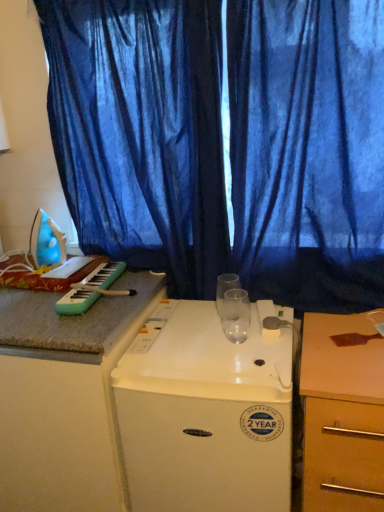
Question: Which direction should I rotate to look at blue sheer curtain at upper center, which ranks as the first curtain in left-to-right order, — up or down?

Choices:
 (A) down
 (B) up

Answer: (B)

Question: Should I look upward or downward to see wooden at right?

Choices:
 (A) down
 (B) up

Answer: (A)

Question: Is white plastic refrigerator at center surrounding blue plastic iron at left?

Choices:
 (A) yes
 (B) no

Answer: (B)

Question: Does white plastic refrigerator at center lie behind blue plastic iron at left?

Choices:
 (A) yes
 (B) no

Answer: (B)

Question: From the image's perspective, is white plastic refrigerator at center above blue plastic iron at left?

Choices:
 (A) no
 (B) yes

Answer: (A)

Question: From the image's perspective, is white plastic refrigerator at center below blue plastic iron at left?

Choices:
 (A) no
 (B) yes

Answer: (B)

Question: Would you say white plastic refrigerator at center is a long distance from blue plastic iron at left?

Choices:
 (A) yes
 (B) no

Answer: (B)

Question: Considering the relative positions of white plastic refrigerator at center and blue plastic iron at left in the image provided, is white plastic refrigerator at center in front of blue plastic iron at left?

Choices:
 (A) yes
 (B) no

Answer: (A)

Question: From the image's perspective, does green plastic keyboard at left appear lower than blue plastic iron at left?

Choices:
 (A) no
 (B) yes

Answer: (B)

Question: Can you confirm if green plastic keyboard at left is bigger than blue plastic iron at left?

Choices:
 (A) yes
 (B) no

Answer: (B)

Question: Could you tell me if green plastic keyboard at left is facing blue plastic iron at left?

Choices:
 (A) no
 (B) yes

Answer: (A)

Question: Is green plastic keyboard at left positioned behind blue plastic iron at left?

Choices:
 (A) yes
 (B) no

Answer: (B)

Question: Is green plastic keyboard at left at the right side of blue plastic iron at left?

Choices:
 (A) yes
 (B) no

Answer: (A)

Question: Considering the relative positions of green plastic keyboard at left and blue plastic iron at left in the image provided, is green plastic keyboard at left in front of blue plastic iron at left?

Choices:
 (A) no
 (B) yes

Answer: (B)

Question: Is wooden at right closer to the viewer compared to blue plastic iron at left?

Choices:
 (A) yes
 (B) no

Answer: (A)